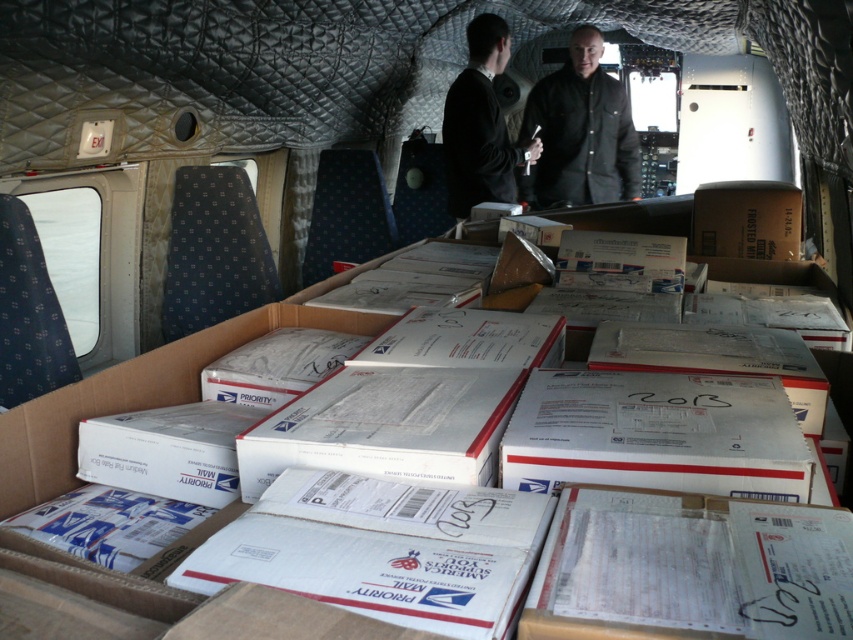
Question: Can you confirm if black matte jacket at center is positioned above black matte suit at center?

Choices:
 (A) yes
 (B) no

Answer: (A)

Question: Is black matte jacket at center below black matte suit at center?

Choices:
 (A) yes
 (B) no

Answer: (B)

Question: Is black matte jacket at center above black matte suit at center?

Choices:
 (A) no
 (B) yes

Answer: (B)